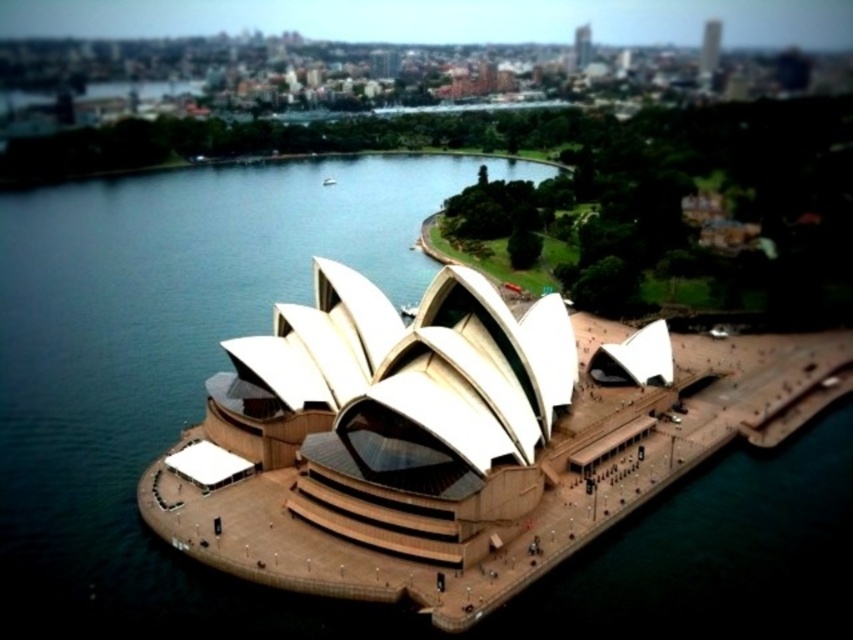
Question: Which object is the closest to the white matte boat at center?

Choices:
 (A) white fabric opera house at center
 (B) clear blue water at center
 (C) white glossy boat at center

Answer: (B)

Question: Can you confirm if white fabric opera house at center is positioned below white matte boat at center?

Choices:
 (A) yes
 (B) no

Answer: (A)

Question: Which point appears closest to the camera in this image?

Choices:
 (A) (67, 620)
 (B) (326, 182)
 (C) (409, 317)
 (D) (553, 504)

Answer: (A)

Question: Can you confirm if white fabric opera house at center is thinner than clear blue water at center?

Choices:
 (A) yes
 (B) no

Answer: (A)

Question: Is clear blue water at center smaller than white glossy boat at center?

Choices:
 (A) yes
 (B) no

Answer: (B)

Question: Estimate the real-world distances between objects in this image. Which object is closer to the clear blue water at center?

Choices:
 (A) white glossy boat at center
 (B) white matte boat at center

Answer: (A)